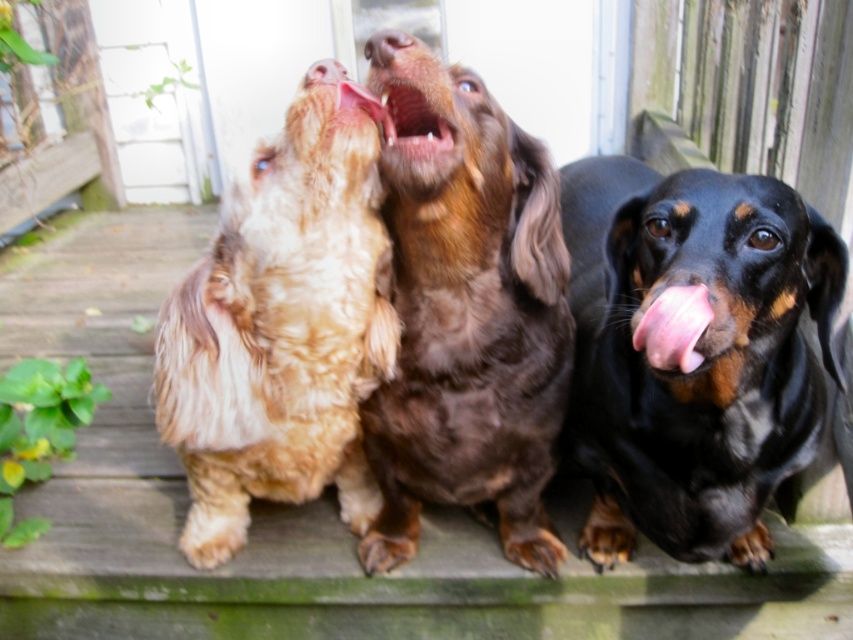
Question: Can you confirm if pink glossy tongue at center is positioned to the right of brown fur nose at upper center?

Choices:
 (A) no
 (B) yes

Answer: (B)

Question: Which point is closer to the camera?

Choices:
 (A) (334, 74)
 (B) (125, 404)

Answer: (A)

Question: Does wooden deck at center appear over shaggy golden-brown dog at center?

Choices:
 (A) yes
 (B) no

Answer: (B)

Question: Which is nearer to the brown fur nose at upper center?

Choices:
 (A) pink flesh at center
 (B) brown fur dog at center
 (C) pink glossy tongue at center
 (D) wooden deck at center

Answer: (C)

Question: Does black shiny dog at center have a larger size compared to pink flesh at center?

Choices:
 (A) yes
 (B) no

Answer: (A)

Question: Estimate the real-world distances between objects in this image. Which object is farther from the wooden deck at center?

Choices:
 (A) pink glossy tongue at center
 (B) black shiny dog at center
 (C) shaggy golden-brown dog at center

Answer: (A)